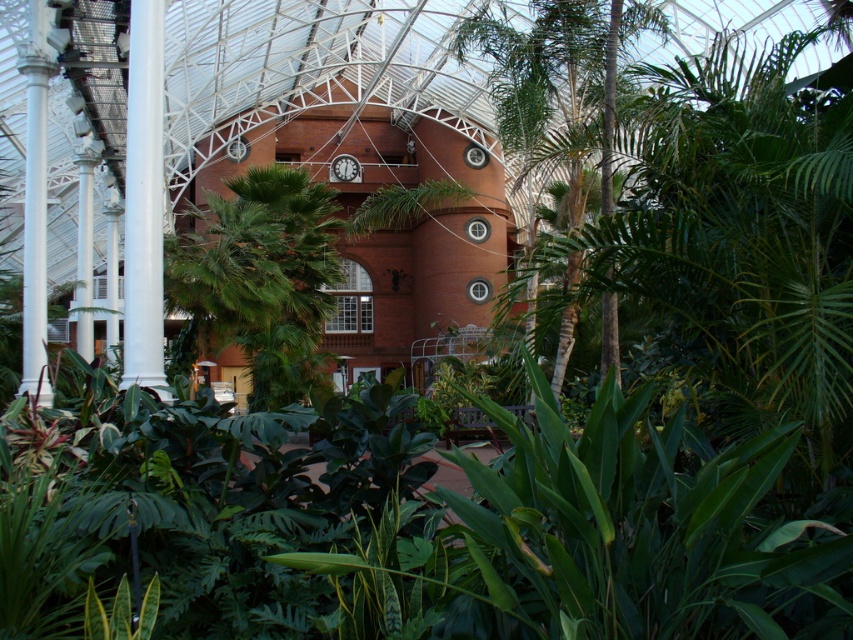
Question: Which point is farther to the camera?

Choices:
 (A) green leafy palm at center
 (B) green leafy tree at center

Answer: (A)

Question: Does green leafy palm at center appear over green leafy tree at center?

Choices:
 (A) no
 (B) yes

Answer: (B)

Question: Does green leafy palm at center have a lesser width compared to green leafy tree at center?

Choices:
 (A) no
 (B) yes

Answer: (A)

Question: Is green leafy palm at center above green leafy tree at center?

Choices:
 (A) no
 (B) yes

Answer: (B)

Question: Among these points, which one is farthest from the camera?

Choices:
 (A) (561, 308)
 (B) (297, 364)

Answer: (B)